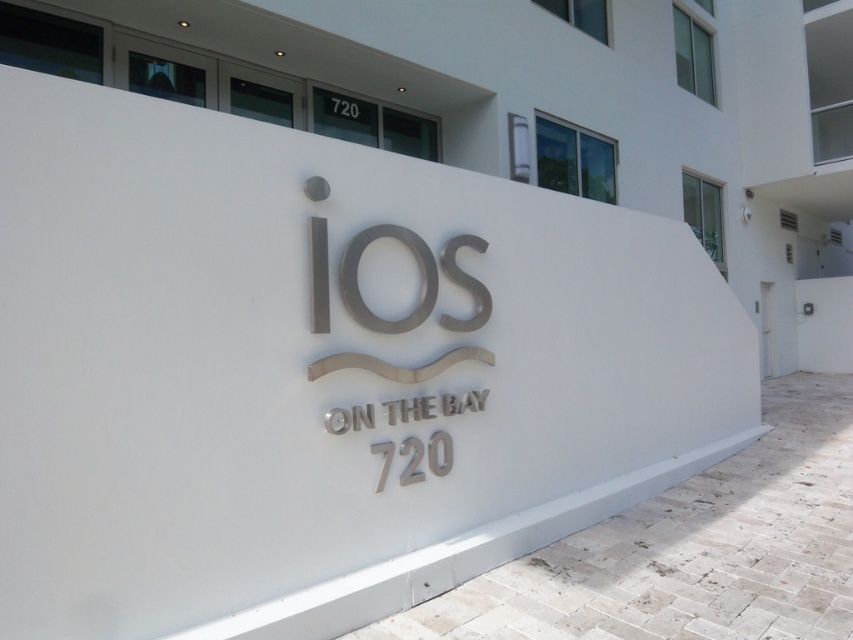
Does point (436, 451) come behind point (352, 109)?

No, (436, 451) is in front of (352, 109).

I want to click on silver metallic number at center, so click(427, 456).

Where is `silver metallic number at center`? The image size is (853, 640). silver metallic number at center is located at coordinates (427, 456).

What do you see at coordinates (357, 280) in the screenshot? I see `satin silver sign at center` at bounding box center [357, 280].

Who is positioned more to the left, satin silver sign at center or white metallic number at upper center?

white metallic number at upper center

Is point (364, 241) less distant than point (329, 109)?

Yes, point (364, 241) is in front of point (329, 109).

At what (x,y) coordinates should I click in order to perform the action: click on satin silver sign at center. Please return your answer as a coordinate pair (x, y). The image size is (853, 640). Looking at the image, I should click on (357, 280).

Does satin silver sign at center appear on the left side of silver metallic number at center?

Correct, you'll find satin silver sign at center to the left of silver metallic number at center.

Where is `satin silver sign at center`? This screenshot has width=853, height=640. satin silver sign at center is located at coordinates (357, 280).

Is point (480, 314) positioned before point (387, 472)?

That is False.

Image resolution: width=853 pixels, height=640 pixels. I want to click on satin silver sign at center, so click(357, 280).